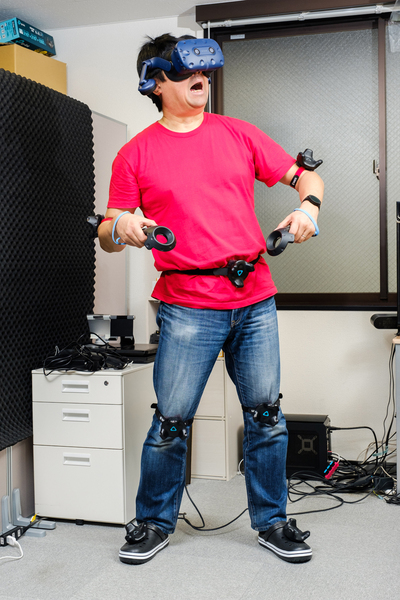
I want to click on corners of white cabinets, so click(x=125, y=523), click(x=121, y=375), click(x=33, y=372), click(x=35, y=514).